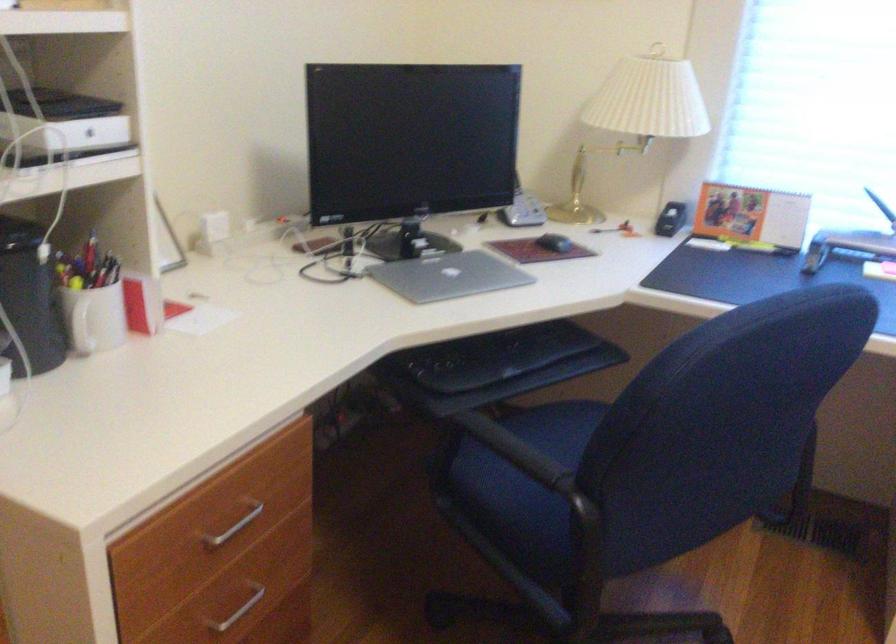
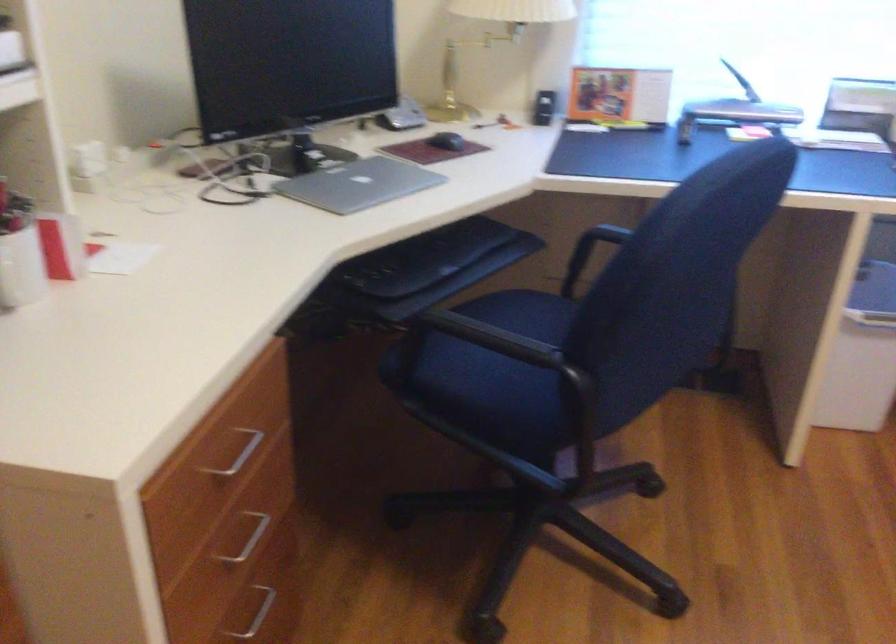
Question: What movement of the cameraman would produce the second image?

Choices:
 (A) Left
 (B) Right
 (C) Forward
 (D) Backward

Answer: (A)